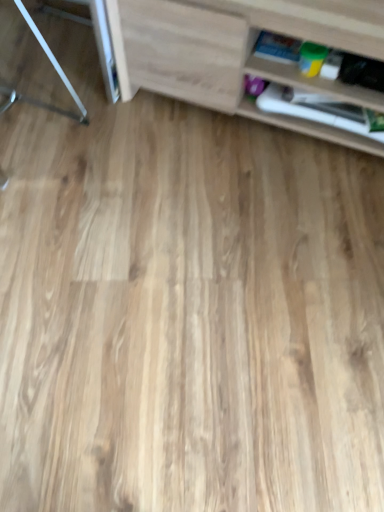
I want to click on light wood cabinet at upper right, placed as the 1th shelf when sorted from front to back, so 233,52.

What do you see at coordinates (305, 76) in the screenshot? The height and width of the screenshot is (512, 384). I see `wooden shelf at right, marked as the second shelf in a front-to-back arrangement` at bounding box center [305, 76].

Measure the distance between wooden shelf at right, the 1th shelf when ordered from back to front, and camera.

wooden shelf at right, the 1th shelf when ordered from back to front, and camera are 1.17 meters apart.

What do you see at coordinates (55, 69) in the screenshot? This screenshot has width=384, height=512. I see `metallic silver table at left` at bounding box center [55, 69].

This screenshot has height=512, width=384. Find the location of `light wood cabinet at upper right, which appears as the second shelf when viewed from the back`. light wood cabinet at upper right, which appears as the second shelf when viewed from the back is located at coordinates (233, 52).

Which object is wider, metallic silver table at left or wooden shelf at right, marked as the second shelf in a front-to-back arrangement?

Wider between the two is metallic silver table at left.

Locate an element on the screen. The height and width of the screenshot is (512, 384). furniture positioned vertically above the wooden shelf at right, the 1th shelf when ordered from back to front (from a real-world perspective) is located at coordinates (55, 69).

Would you consider metallic silver table at left to be distant from wooden shelf at right, marked as the second shelf in a front-to-back arrangement?

Actually, metallic silver table at left and wooden shelf at right, marked as the second shelf in a front-to-back arrangement, are a little close together.

Which is in front, point (75, 98) or point (273, 35)?

The point (273, 35) is in front.

Based on the photo, is the surface of wooden shelf at right, marked as the second shelf in a front-to-back arrangement, in direct contact with light wood cabinet at upper right, placed as the 1th shelf when sorted from front to back?

No, wooden shelf at right, marked as the second shelf in a front-to-back arrangement, is not in contact with light wood cabinet at upper right, placed as the 1th shelf when sorted from front to back.

Does point (336, 61) come closer to viewer compared to point (277, 18)?

That is False.

Is wooden shelf at right, the 1th shelf when ordered from back to front, aimed at light wood cabinet at upper right, which appears as the second shelf when viewed from the back?

Yes.

Where is `shelf that appears above the wooden shelf at right, the 1th shelf when ordered from back to front (from the image's perspective)`? This screenshot has width=384, height=512. shelf that appears above the wooden shelf at right, the 1th shelf when ordered from back to front (from the image's perspective) is located at coordinates (233, 52).

Is light wood cabinet at upper right, which appears as the second shelf when viewed from the back, touching wooden shelf at right, the 1th shelf when ordered from back to front?

light wood cabinet at upper right, which appears as the second shelf when viewed from the back, and wooden shelf at right, the 1th shelf when ordered from back to front, are clearly separated.

What's the angular difference between light wood cabinet at upper right, which appears as the second shelf when viewed from the back, and wooden shelf at right, the 1th shelf when ordered from back to front,'s facing directions?

There is a 4.48e-05-degree angle between the facing directions of light wood cabinet at upper right, which appears as the second shelf when viewed from the back, and wooden shelf at right, the 1th shelf when ordered from back to front.

From a real-world perspective, is light wood cabinet at upper right, placed as the 1th shelf when sorted from front to back, positioned over wooden shelf at right, the 1th shelf when ordered from back to front, based on gravity?

Yes, from a real-world perspective, light wood cabinet at upper right, placed as the 1th shelf when sorted from front to back, is above wooden shelf at right, the 1th shelf when ordered from back to front.

Is light wood cabinet at upper right, which appears as the second shelf when viewed from the back, turned away from wooden shelf at right, marked as the second shelf in a front-to-back arrangement?

That's right, light wood cabinet at upper right, which appears as the second shelf when viewed from the back, is facing away from wooden shelf at right, marked as the second shelf in a front-to-back arrangement.

Based on the photo, from their relative heights in the image, would you say wooden shelf at right, marked as the second shelf in a front-to-back arrangement, is taller or shorter than metallic silver table at left?

Clearly, wooden shelf at right, marked as the second shelf in a front-to-back arrangement, is shorter compared to metallic silver table at left.

How many degrees apart are the facing directions of wooden shelf at right, marked as the second shelf in a front-to-back arrangement, and metallic silver table at left?

The angular difference between wooden shelf at right, marked as the second shelf in a front-to-back arrangement, and metallic silver table at left is 91.1 degrees.

Considering the points (293, 41) and (75, 97), which point is behind, point (293, 41) or point (75, 97)?

The point (75, 97) is behind.

Is light wood cabinet at upper right, which appears as the second shelf when viewed from the back, next to metallic silver table at left?

No, light wood cabinet at upper right, which appears as the second shelf when viewed from the back, is not next to metallic silver table at left.

Between light wood cabinet at upper right, which appears as the second shelf when viewed from the back, and metallic silver table at left, which one appears on the left side from the viewer's perspective?

Positioned to the left is metallic silver table at left.

Is light wood cabinet at upper right, which appears as the second shelf when viewed from the back, shorter than metallic silver table at left?

Incorrect, the height of light wood cabinet at upper right, which appears as the second shelf when viewed from the back, does not fall short of that of metallic silver table at left.

Is metallic silver table at left taller or shorter than light wood cabinet at upper right, which appears as the second shelf when viewed from the back?

metallic silver table at left is shorter than light wood cabinet at upper right, which appears as the second shelf when viewed from the back.

Is metallic silver table at left at the left side of light wood cabinet at upper right, placed as the 1th shelf when sorted from front to back?

Yes, metallic silver table at left is to the left of light wood cabinet at upper right, placed as the 1th shelf when sorted from front to back.

From the image's perspective, which one is positioned lower, metallic silver table at left or light wood cabinet at upper right, placed as the 1th shelf when sorted from front to back?

light wood cabinet at upper right, placed as the 1th shelf when sorted from front to back, appears lower in the image.

What are the coordinates of `furniture above the wooden shelf at right, the 1th shelf when ordered from back to front (from the image's perspective)` in the screenshot? It's located at (55, 69).

I want to click on shelf on the left of wooden shelf at right, the 1th shelf when ordered from back to front, so click(233, 52).

Based on their spatial positions, is wooden shelf at right, marked as the second shelf in a front-to-back arrangement, or light wood cabinet at upper right, which appears as the second shelf when viewed from the back, closer to metallic silver table at left?

light wood cabinet at upper right, which appears as the second shelf when viewed from the back, is positioned closer to the anchor metallic silver table at left.

When comparing their distances from light wood cabinet at upper right, placed as the 1th shelf when sorted from front to back, does wooden shelf at right, the 1th shelf when ordered from back to front, or metallic silver table at left seem closer?

wooden shelf at right, the 1th shelf when ordered from back to front, is closer to light wood cabinet at upper right, placed as the 1th shelf when sorted from front to back.

Which object lies nearer to the anchor point wooden shelf at right, the 1th shelf when ordered from back to front, metallic silver table at left or light wood cabinet at upper right, which appears as the second shelf when viewed from the back?

light wood cabinet at upper right, which appears as the second shelf when viewed from the back, lies closer to wooden shelf at right, the 1th shelf when ordered from back to front, than the other object.

Based on their spatial positions, is light wood cabinet at upper right, placed as the 1th shelf when sorted from front to back, or wooden shelf at right, the 1th shelf when ordered from back to front, further from metallic silver table at left?

wooden shelf at right, the 1th shelf when ordered from back to front, is positioned further to the anchor metallic silver table at left.

Looking at the image, which one is located closer to light wood cabinet at upper right, placed as the 1th shelf when sorted from front to back, metallic silver table at left or wooden shelf at right, the 1th shelf when ordered from back to front?

wooden shelf at right, the 1th shelf when ordered from back to front, is positioned closer to the anchor light wood cabinet at upper right, placed as the 1th shelf when sorted from front to back.

From the image, which object appears to be nearer to wooden shelf at right, the 1th shelf when ordered from back to front, light wood cabinet at upper right, placed as the 1th shelf when sorted from front to back, or metallic silver table at left?

light wood cabinet at upper right, placed as the 1th shelf when sorted from front to back.

Image resolution: width=384 pixels, height=512 pixels. Identify the location of shelf between metallic silver table at left and wooden shelf at right, the 1th shelf when ordered from back to front, in the horizontal direction. (x=233, y=52).